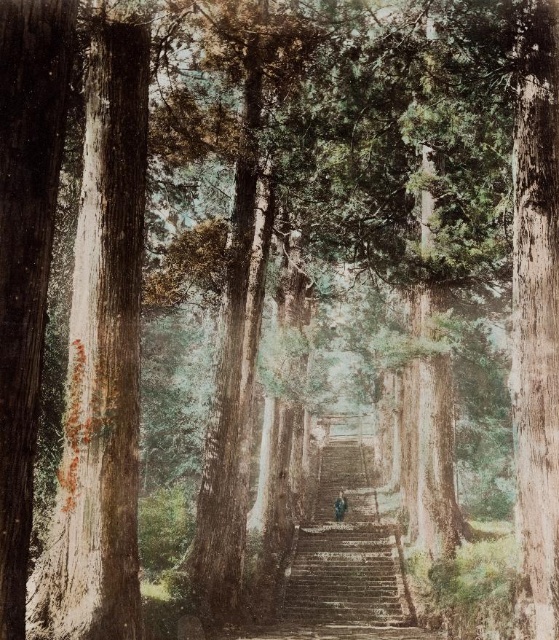
Between smooth brown bark at left and brown leather jacket at center, which one is positioned lower?

brown leather jacket at center

Is smooth brown bark at left shorter than brown leather jacket at center?

Incorrect, smooth brown bark at left's height does not fall short of brown leather jacket at center's.

Does point (121, 385) lie behind point (342, 502)?

No, (121, 385) is closer to viewer.

What are the coordinates of `smooth brown bark at left` in the screenshot? It's located at (101, 362).